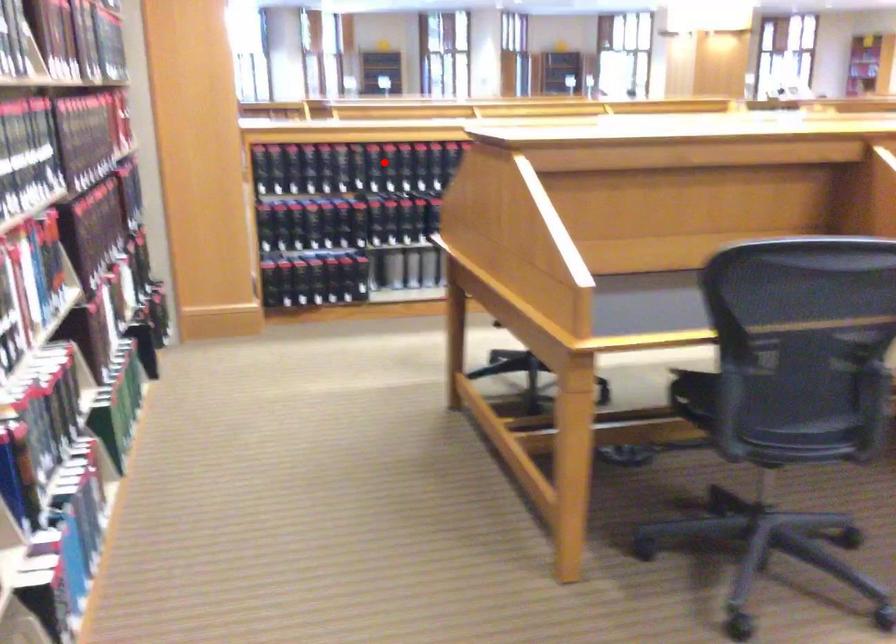
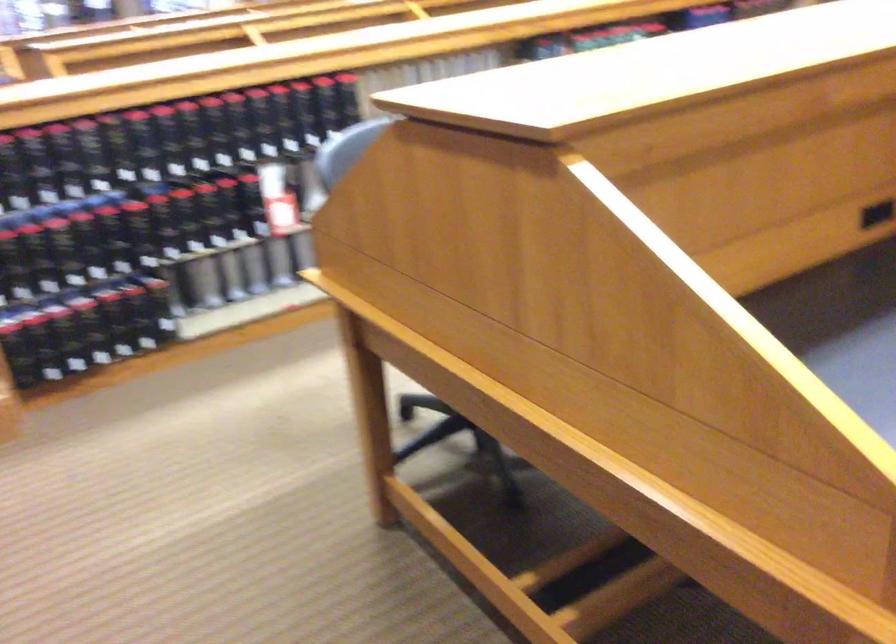
Question: I am providing you with two images of the same scene from different viewpoints. In image1, a red point is highlighted. Considering the same 3D point in image2, which of the following is correct?

Choices:
 (A) It is closer
 (B) It is farther

Answer: (A)